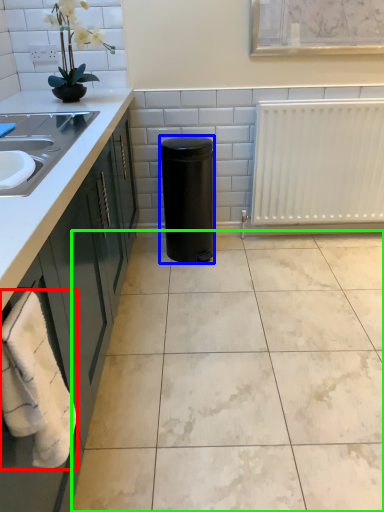
Question: Which object is the farthest from bath towel (highlighted by a red box)? Choose among these: appliance (highlighted by a blue box) or ceramic tile (highlighted by a green box).

Choices:
 (A) appliance
 (B) ceramic tile

Answer: (A)